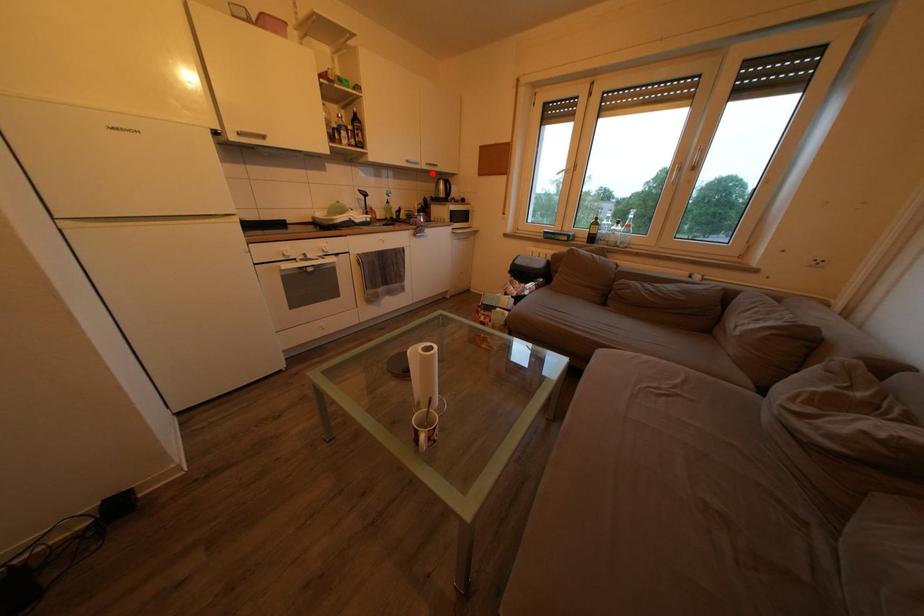
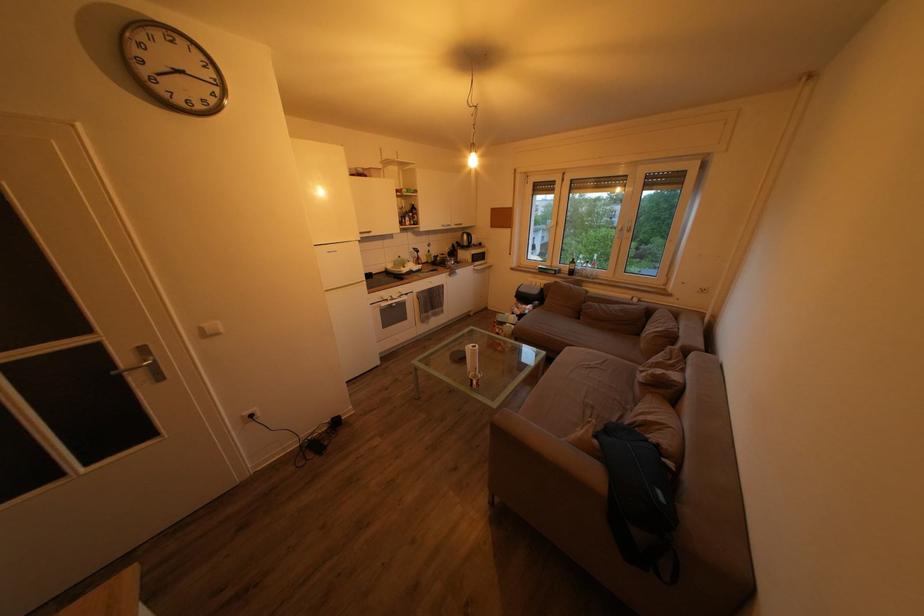
Where in the second image is the point corresponding to the highlighted location from the first image?

(462, 233)